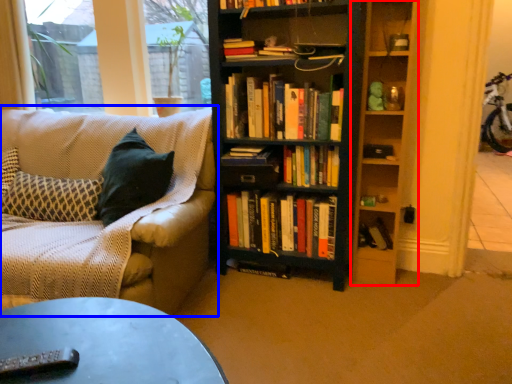
Question: Among these objects, which one is nearest to the camera, shelf (highlighted by a red box) or studio couch (highlighted by a blue box)?

Choices:
 (A) shelf
 (B) studio couch

Answer: (B)